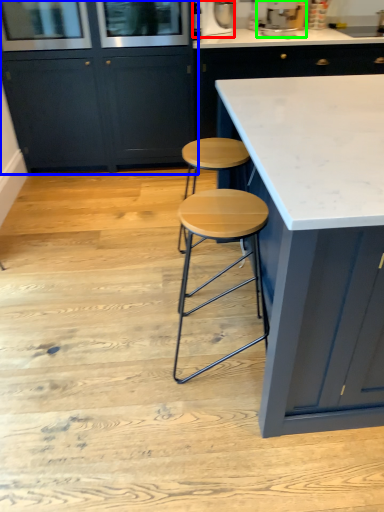
Question: Considering the real-world distances, which object is closest to appliance (highlighted by a red box)? cabinetry (highlighted by a blue box) or appliance (highlighted by a green box).

Choices:
 (A) cabinetry
 (B) appliance

Answer: (B)